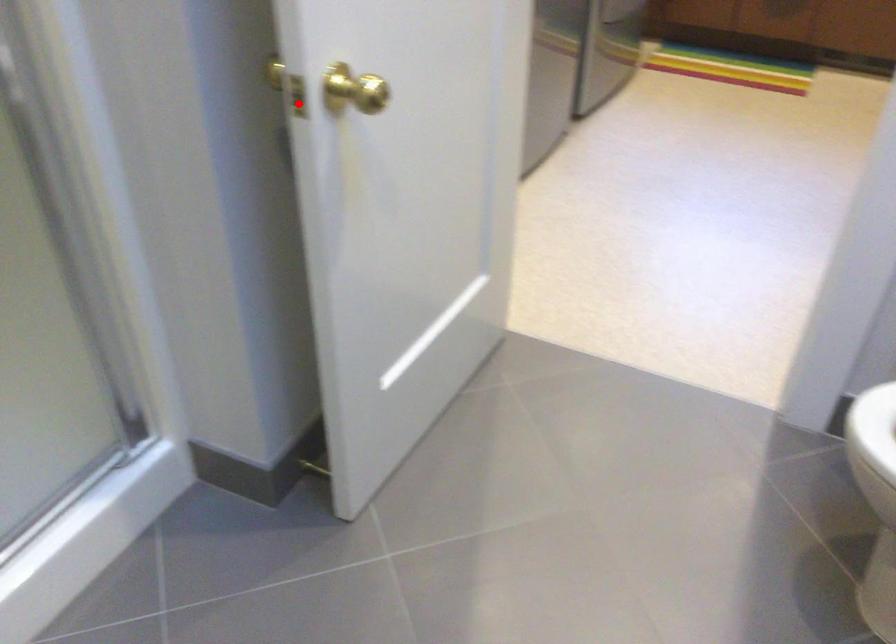
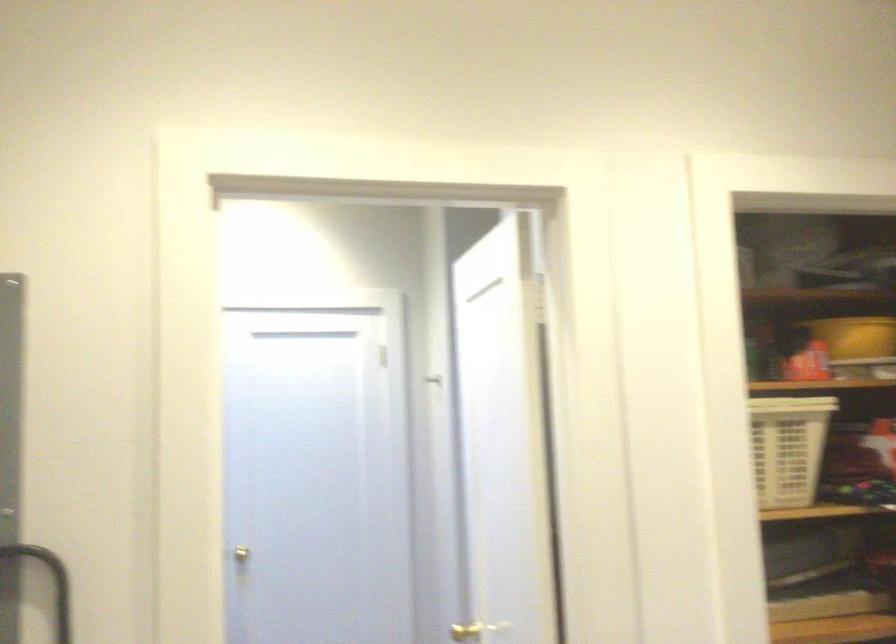
Question: I am providing you with two images of the same scene from different viewpoints. A red point is shown in image1. For the corresponding object point in image2, is it positioned nearer or farther from the camera?

Choices:
 (A) Nearer
 (B) Farther

Answer: (B)